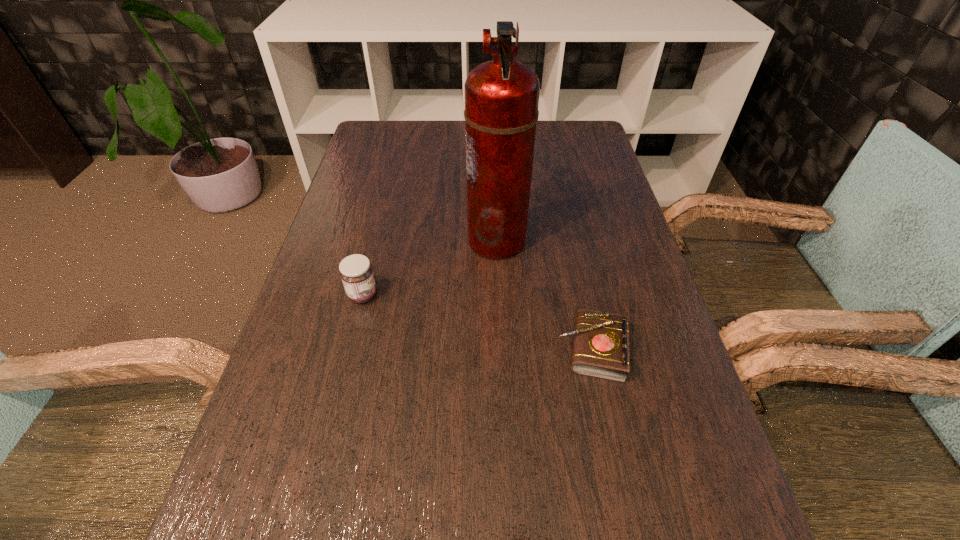
You are a GUI agent. You are given a task and a screenshot of the screen. Output one action in this format:
    pyautogui.click(x=<x>, y=<y>)
    Task: Click on the tallest object
    
    Given the screenshot: What is the action you would take?
    pyautogui.click(x=501, y=113)

Identify the location of the farthest object. The height and width of the screenshot is (540, 960). (501, 113).

Identify the location of the second farthest object. (356, 272).

Find the location of a particular element. Image resolution: width=960 pixels, height=540 pixels. the second tallest object is located at coordinates (356, 272).

Where is `the nearest object`? the nearest object is located at coordinates (601, 339).

Identify the location of the rightmost object. The image size is (960, 540). coord(601,339).

Find the location of a particular element. The image size is (960, 540). vacant region located 0.120m on the side of the fire extinguisher with the handle and hose is located at coordinates (419, 240).

This screenshot has width=960, height=540. I want to click on free point located 0.250m on the side of the fire extinguisher with the handle and hose, so click(366, 240).

Identify the location of vacant region located 0.160m on the side of the fire extinguisher with the handle and hose. The image size is (960, 540). (402, 240).

The width and height of the screenshot is (960, 540). I want to click on blank area located on the front label of the second farthest object, so click(x=534, y=295).